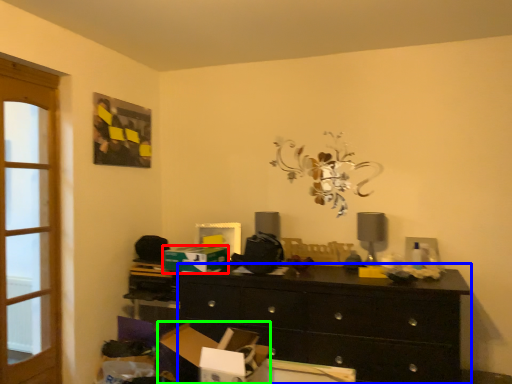
Question: Considering the real-world distances, which object is closest to cardboard box (highlighted by a red box)? chest of drawers (highlighted by a blue box) or cardboard box (highlighted by a green box).

Choices:
 (A) chest of drawers
 (B) cardboard box

Answer: (B)